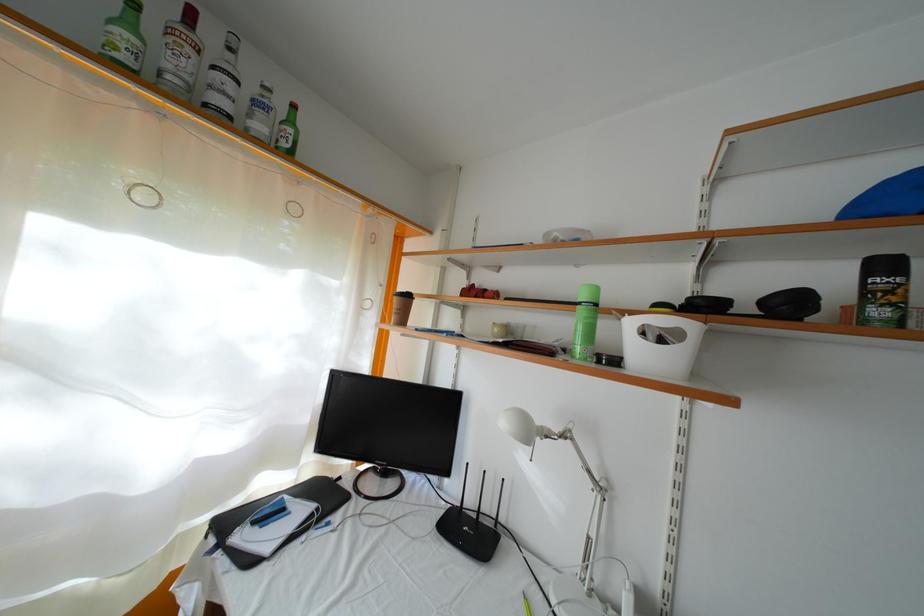
Locate an element on the screen. Image resolution: width=924 pixels, height=616 pixels. white basket handle is located at coordinates (660, 344).